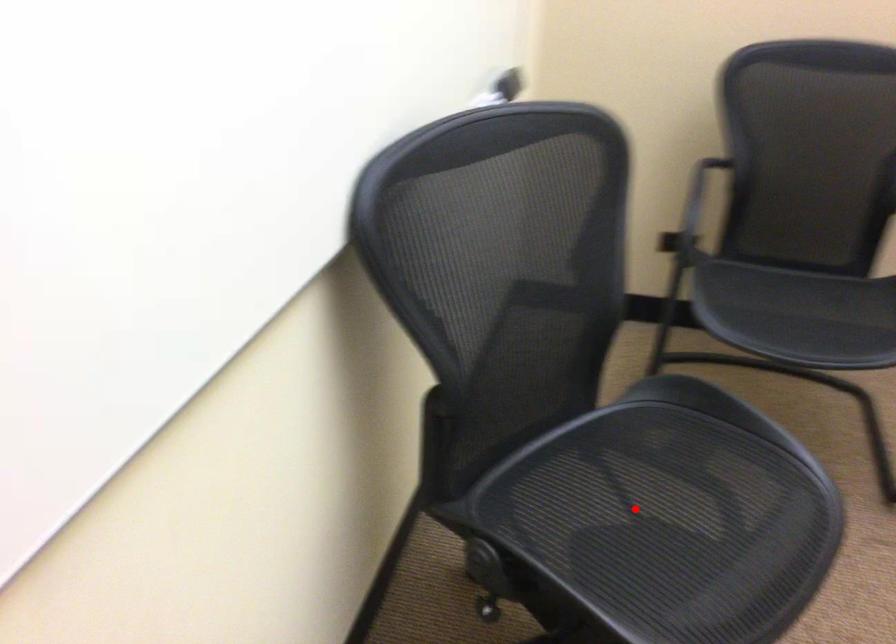
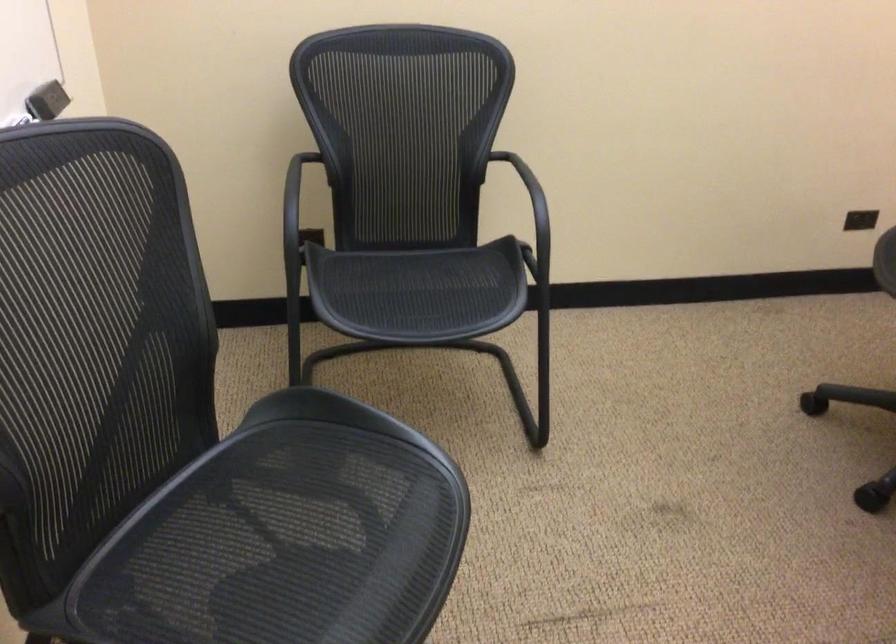
The point at the highlighted location is marked in the first image. Where is the corresponding point in the second image?

(259, 547)